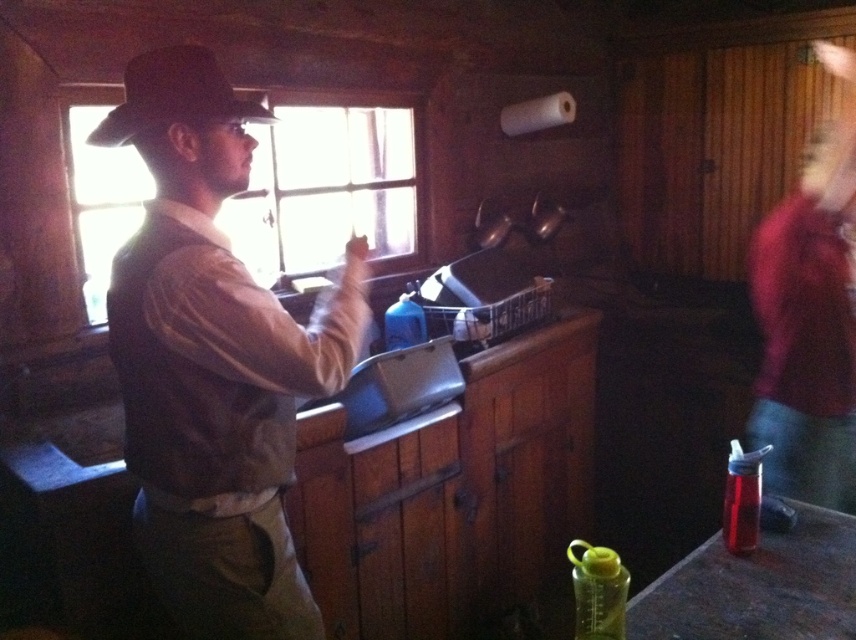
You are a tailor working in this rustic kitchen and need to hang the brown leather vest at center and the black felt hat at upper left on a rack. The rack can only hold items within 12 inches of each other. Can both items be placed on the rack without exceeding the rack spacing?

The distance between the brown leather vest at center and black felt hat at upper left is 12.48 inches, which exceeds the rack spacing limit of 12 inches. Therefore, they cannot both be placed on the rack without exceeding the spacing requirement.

You are standing in the rustic kitchen and want to place a new decorative item on the counter. The counter is located at point coordinates between 0.5 and 0.3 in the image. Is the brown leather vest at center currently occupying that space?

The brown leather vest at center is located at point coordinates of (214, 362), which falls within the counter area between 0.5 and 0.3. Therefore, the vest is occupying that space.